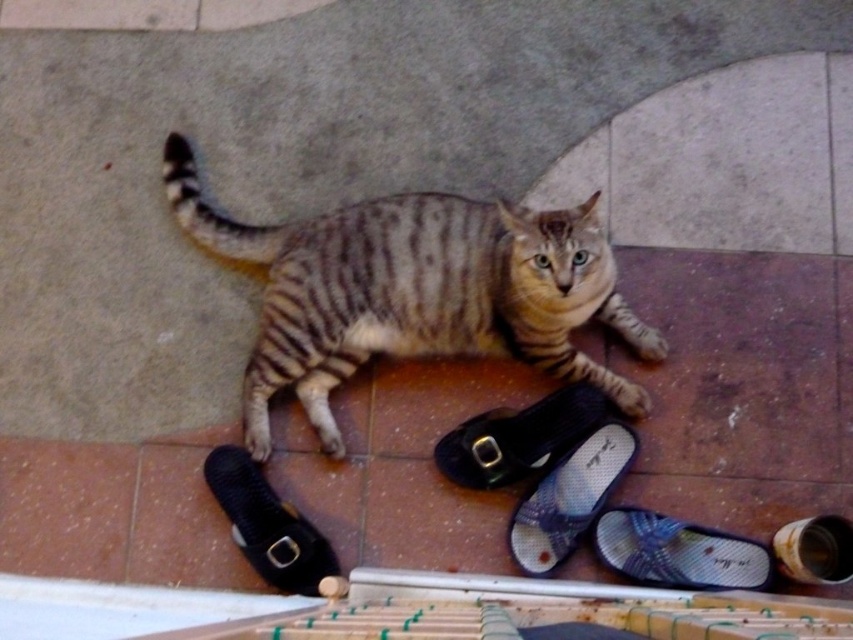
Who is lower down, striped fur cat at center or black fabric slipper at lower left?

black fabric slipper at lower left

Is point (178, 134) positioned behind point (306, 572)?

Yes.

You are a GUI agent. You are given a task and a screenshot of the screen. Output one action in this format:
    pyautogui.click(x=<x>, y=<y>)
    Task: Click on the striped fur cat at center
    This screenshot has width=853, height=640.
    Given the screenshot: What is the action you would take?
    pyautogui.click(x=415, y=291)

Which of these two, black leather shoe at center or blue fabric slipper at lower right, stands shorter?

blue fabric slipper at lower right is shorter.

Is point (508, 422) positioned before point (656, 513)?

No, (508, 422) is further to viewer.

Where is `black leather shoe at center`? The height and width of the screenshot is (640, 853). black leather shoe at center is located at coordinates [519, 436].

Can you confirm if black leather shoe at center is thinner than black fabric slipper at lower left?

Incorrect, black leather shoe at center's width is not less than black fabric slipper at lower left's.

Can you confirm if black leather shoe at center is positioned to the left of black fabric slipper at lower left?

In fact, black leather shoe at center is to the right of black fabric slipper at lower left.

The image size is (853, 640). What do you see at coordinates (519, 436) in the screenshot? I see `black leather shoe at center` at bounding box center [519, 436].

Find the location of a particular element. Image resolution: width=853 pixels, height=640 pixels. black leather shoe at center is located at coordinates (519, 436).